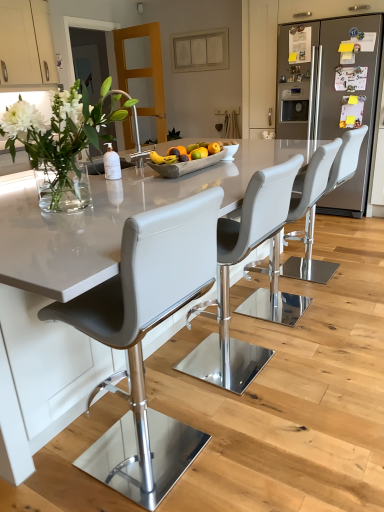
Locate an element on the screen. This screenshot has height=512, width=384. blank area to the left of matte gray chair at center, which ranks as the fourth chair in back-to-front order is located at coordinates (63, 468).